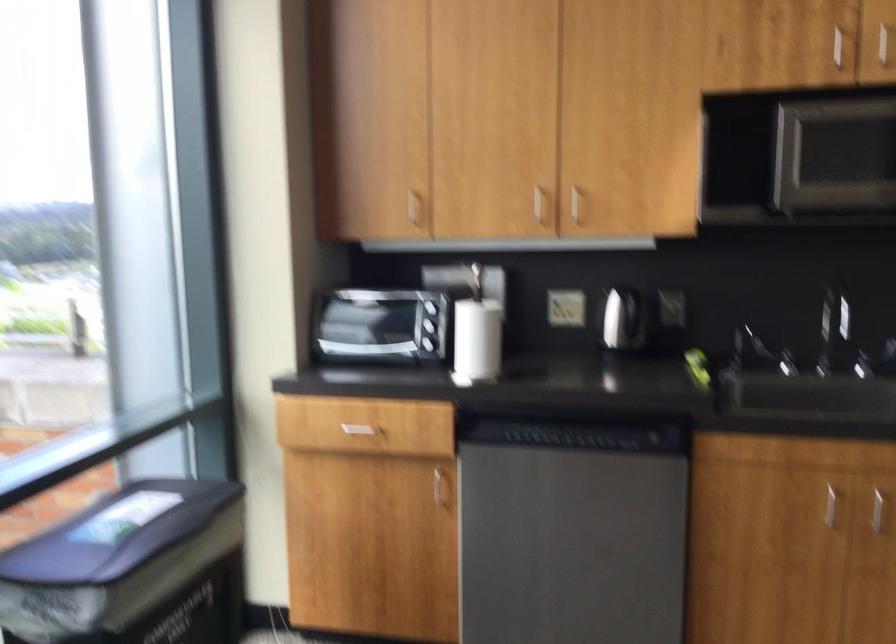
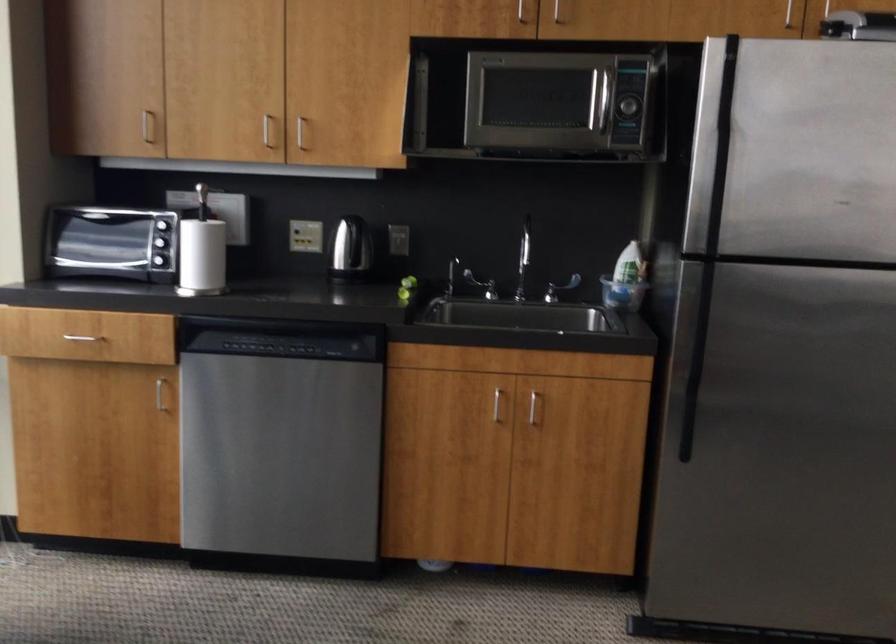
In the second image, find the point that corresponds to the point at 572,202 in the first image.

(300, 131)